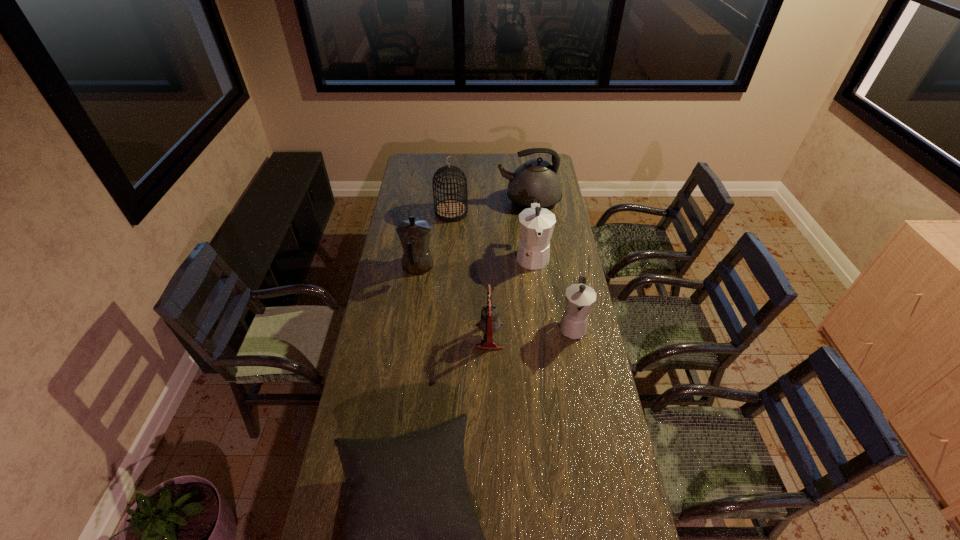
The width and height of the screenshot is (960, 540). Find the location of `empty location between the birdcage and the kettle`. empty location between the birdcage and the kettle is located at coordinates (490, 206).

Find the location of a particular element. This screenshot has height=540, width=960. vacant space in between the kettle and the leftmost coffeepot is located at coordinates (473, 234).

Image resolution: width=960 pixels, height=540 pixels. I want to click on the second closest object to the leftmost coffeepot, so click(489, 323).

Find the location of a particular element. the second closest object to the bell is located at coordinates (537, 224).

In order to click on coffeepot that can be found as the second closest to the nearest coffeepot in this screenshot , I will do `click(414, 234)`.

Locate which coffeepot is the third closest to the bell. Please provide its 2D coordinates. Your answer should be formatted as a tuple, i.e. [(x, y)], where the tuple contains the x and y coordinates of a point satisfying the conditions above.

[(414, 234)]